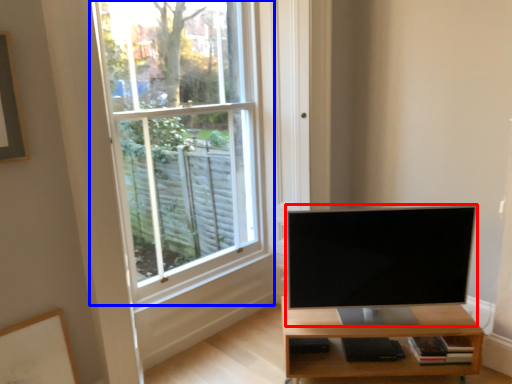
Question: Which object is further to the camera taking this photo, television (highlighted by a red box) or window (highlighted by a blue box)?

Choices:
 (A) television
 (B) window

Answer: (A)